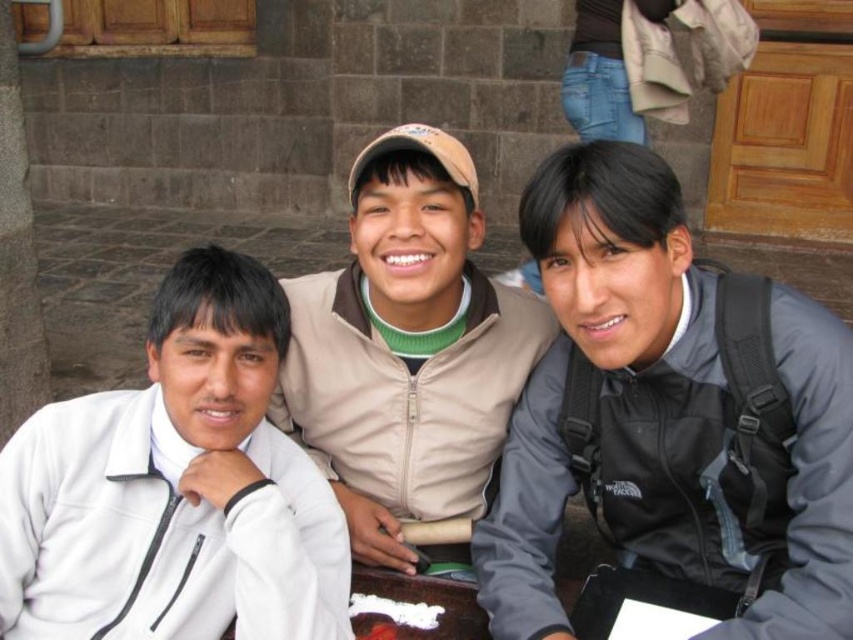
You are a photographer trying to capture a clear photo of the gray matte jacket at center without the white matte jacket at left blocking it. What should you do?

The white matte jacket at left is behind the gray matte jacket at center, so you can take the photo as it is without any obstruction since the white matte jacket is already behind the gray one.

Looking at this image, you are a photographer trying to capture a candid shot of the two jackets in the scene. Since the gray matte jacket at center and the white matte jacket at left are both in your viewfinder, which one would you need to adjust your camera angle upwards to focus on?

The gray matte jacket at center is above the white matte jacket at left, so you would need to adjust your camera angle upwards to focus on the gray matte jacket at center.